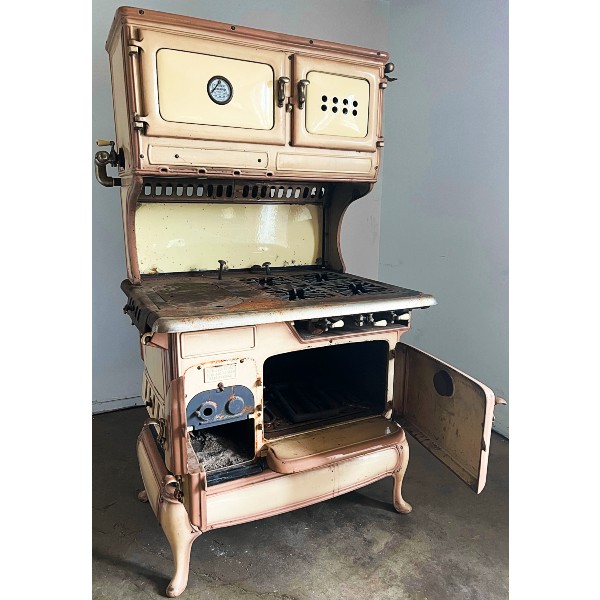
Where is `wall`? wall is located at coordinates (446, 112).